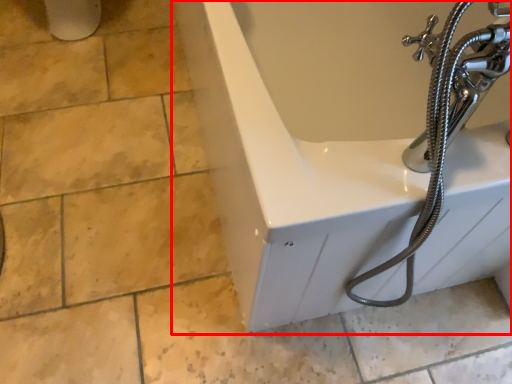
Question: From the image, what is the correct spatial relationship of bathtub (annotated by the red box) in relation to garden hose?

Choices:
 (A) left
 (B) right

Answer: (A)